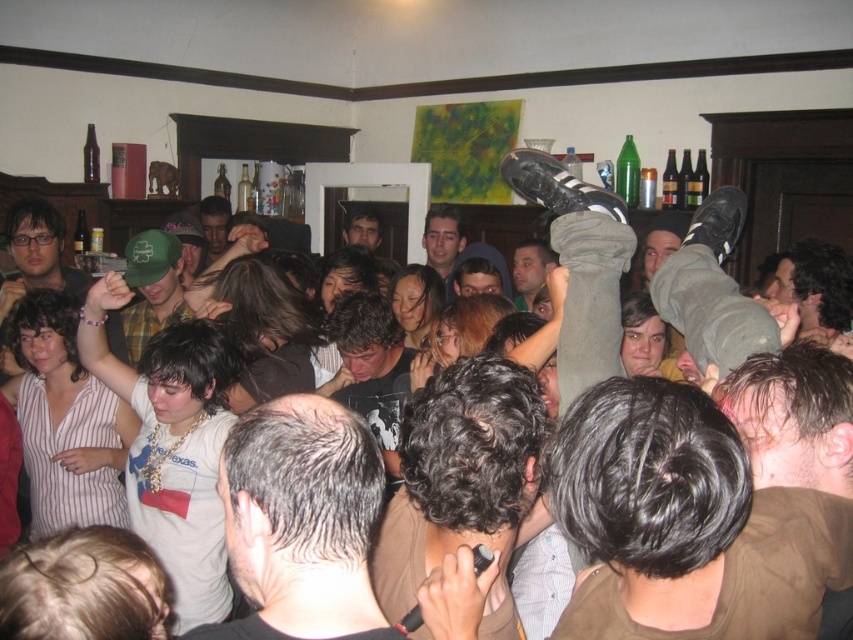
Question: Which point appears closest to the camera in this image?

Choices:
 (A) (32, 262)
 (B) (525, 244)

Answer: (A)

Question: Can you confirm if green plaid shirt at center is positioned above matte green cap at center?

Choices:
 (A) no
 (B) yes

Answer: (A)

Question: Which of the following is the closest to the observer?

Choices:
 (A) green plaid shirt at center
 (B) smooth black shirt at center
 (C) dark brown hair at center
 (D) matte green cap at center

Answer: (A)

Question: Which of the following is the closest to the observer?

Choices:
 (A) dark gray hair at center
 (B) green plaid shirt at center

Answer: (A)

Question: Can you confirm if green plaid shirt at center is bigger than smooth black shirt at center?

Choices:
 (A) yes
 (B) no

Answer: (A)

Question: Is matte black shirt at center bigger than smooth black shirt at center?

Choices:
 (A) no
 (B) yes

Answer: (B)